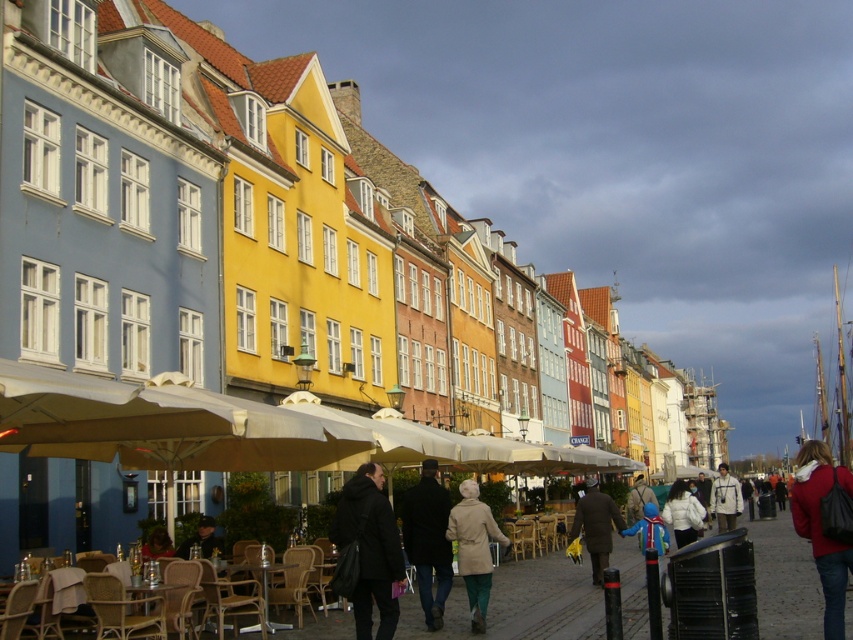
Between black matte coat at center and dark blue jacket at lower left, which one has less height?

dark blue jacket at lower left is shorter.

Is black matte coat at center positioned at the back of dark blue jacket at lower left?

No, black matte coat at center is closer to the viewer.

Who is more forward, (399, 552) or (206, 532)?

Point (399, 552) is more forward.

This screenshot has width=853, height=640. I want to click on black matte coat at center, so click(370, 548).

Is brown wool coat at center thinner than blue denim jacket at center?

Correct, brown wool coat at center's width is less than blue denim jacket at center's.

Is point (596, 556) behind point (647, 499)?

No, it is in front of (647, 499).

Image resolution: width=853 pixels, height=640 pixels. What are the coordinates of `brown wool coat at center` in the screenshot? It's located at (596, 525).

Between white matte jacket at lower right and dark blue jacket at lower left, which one is positioned lower?

white matte jacket at lower right is lower down.

Can you confirm if white matte jacket at lower right is positioned above dark blue jacket at lower left?

No, white matte jacket at lower right is not above dark blue jacket at lower left.

Does point (682, 541) lie in front of point (212, 544)?

No.

Locate an element on the screen. white matte jacket at lower right is located at coordinates (683, 513).